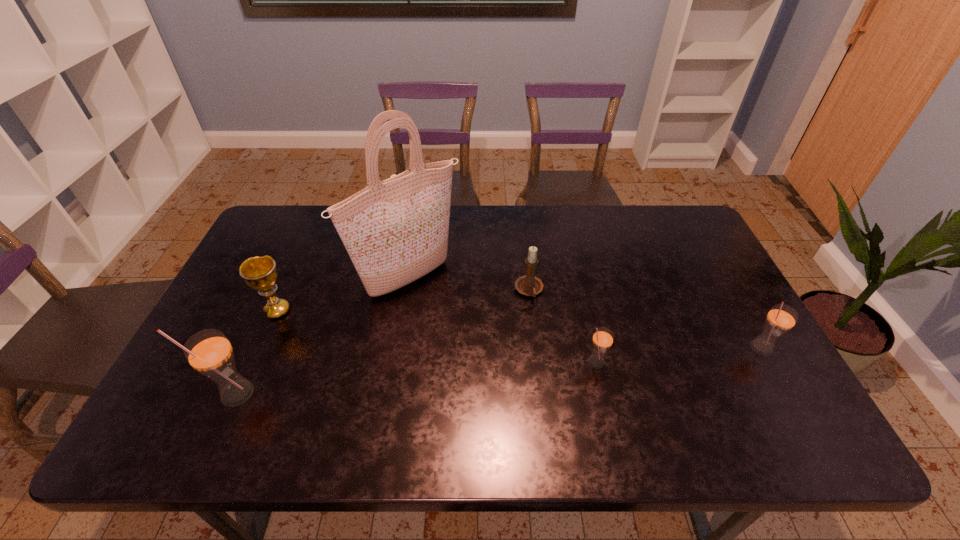
The height and width of the screenshot is (540, 960). What are the coordinates of `object that is positioned at the near left corner` in the screenshot? It's located at (209, 352).

In the image, there is a desktop. Where is `vacant area at the far edge`? The height and width of the screenshot is (540, 960). vacant area at the far edge is located at coordinates (624, 212).

I want to click on vacant space at the near edge of the desktop, so click(x=595, y=379).

Identify the location of free space at the right edge of the desktop. (668, 268).

The height and width of the screenshot is (540, 960). I want to click on free spot at the far left corner of the desktop, so click(x=286, y=233).

Identify the location of free space at the near right corner of the desktop. (780, 377).

The height and width of the screenshot is (540, 960). I want to click on free space between the second straw from right to left and the rightmost straw, so click(x=678, y=355).

This screenshot has height=540, width=960. In order to click on vacant area between the chalice and the rightmost straw in this screenshot , I will do `click(518, 329)`.

Where is `free space between the second object from right to left and the chalice`? The width and height of the screenshot is (960, 540). free space between the second object from right to left and the chalice is located at coordinates (436, 336).

The width and height of the screenshot is (960, 540). I want to click on free space between the third object from right to left and the third object from left to right, so click(x=469, y=286).